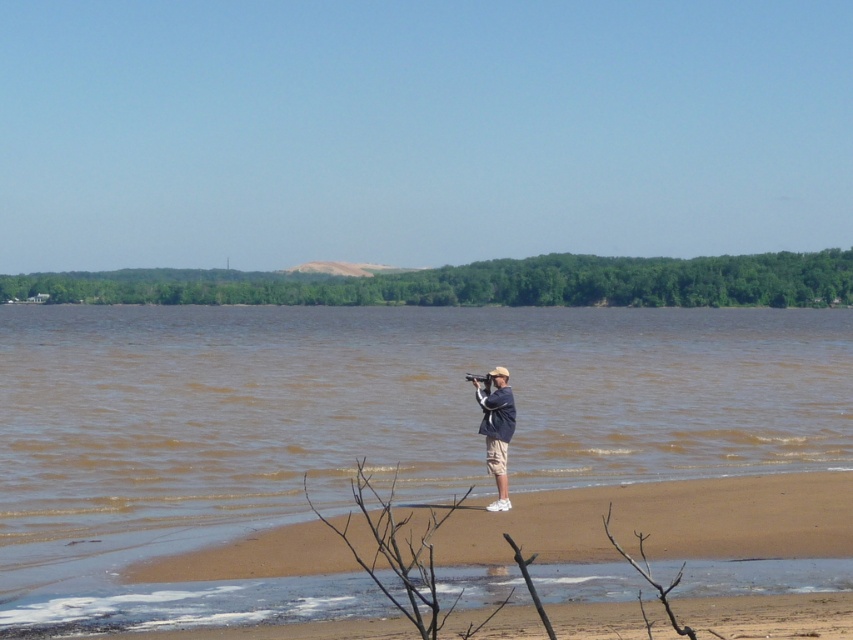
You are standing on the lakeside and want to take a photo of two points in the lake. The first point is at coordinate point (654, 506) and the second point is at coordinate point (492, 417). Which point is closer to you?

Point (654, 506) is further to the viewer than point (492, 417), so the second point is closer to you.

You are a photographer trying to capture the entire brown sandy beach at lower center and the light blue denim shirt at center in a single shot. Given that your camera can only focus on objects within a 100cm width, can you fit both objects in the frame?

The brown sandy beach at lower center is larger in size than the light blue denim shirt at center, so it might be challenging to fit both within the 100cm width. However, since the exact dimensions aren